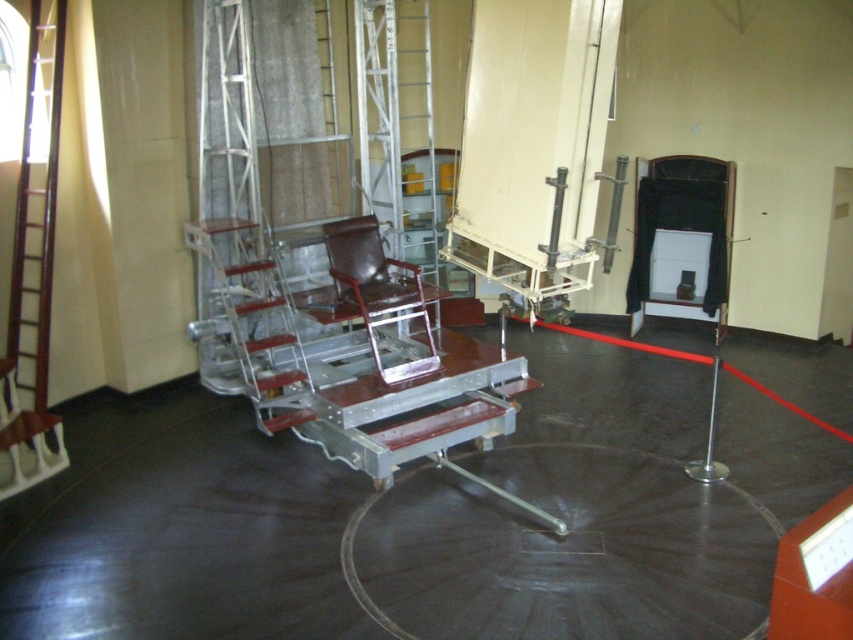
You are standing in the museum and see both the metallic silver ladder at left and the wooden ladder at left. Which ladder is positioned higher up in the scene?

The metallic silver ladder at left is positioned higher up in the scene because it is above the wooden ladder at left.